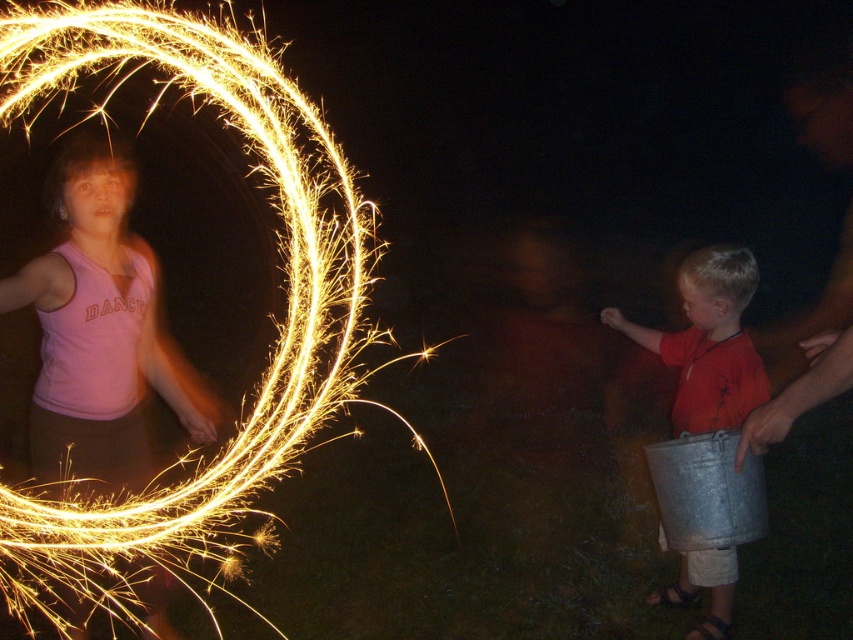
You are a photographer trying to capture the bright metallic sparkler at upper left and the metallic bucket at right in a single frame. Based on their sizes in the image, which object will appear larger in your photo?

The bright metallic sparkler at upper left will appear larger in the photo because it is bigger than the metallic bucket at right according to the description.

You are a photographer trying to capture the bright metallic sparkler at upper left and the metallic bucket at right in a single photo. Which object should you focus on first if you want to ensure both are in sharp focus, considering their heights?

The bright metallic sparkler at upper left is taller than the metallic bucket at right, so focusing on the sparkler first will help ensure both are in focus as the bucket is shorter and closer to the camera.

You are organizing a fireworks display and need to ensure that the bright metallic sparkler at upper left and the metallic bucket at right can fit on a shelf that is 1 meter wide. Based on their sizes, will both items fit side by side?

The bright metallic sparkler at upper left is wider than the metallic bucket at right. However, since the sparkler is only slightly wider and the total width of both items combined is less than 1 meter, they should fit side by side on the shelf.